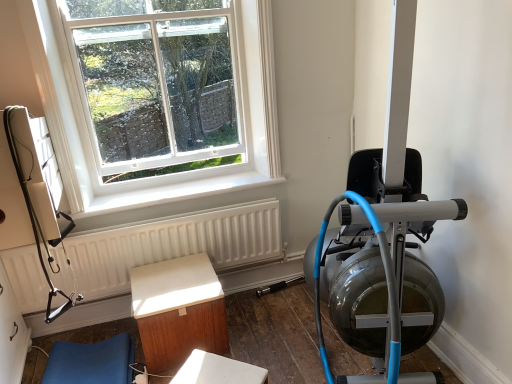
Question: Does light brown wood table at center, acting as the 2th furniture starting from the left, have a lesser width compared to blue rubber rowing machine at right?

Choices:
 (A) no
 (B) yes

Answer: (A)

Question: From a real-world perspective, is light brown wood table at center, the first furniture when ordered from right to left, positioned over blue rubber rowing machine at right based on gravity?

Choices:
 (A) no
 (B) yes

Answer: (A)

Question: From a real-world perspective, is light brown wood table at center, the first furniture when ordered from right to left, below blue rubber rowing machine at right?

Choices:
 (A) yes
 (B) no

Answer: (A)

Question: Could you tell me if light brown wood table at center, the first furniture when ordered from right to left, is turned towards blue rubber rowing machine at right?

Choices:
 (A) no
 (B) yes

Answer: (A)

Question: Can you confirm if light brown wood table at center, acting as the 2th furniture starting from the left, is shorter than blue rubber rowing machine at right?

Choices:
 (A) no
 (B) yes

Answer: (B)

Question: Is blue rubber rowing machine at right situated inside blue fabric cushion at lower left, placed as the first furniture when sorted from left to right, or outside?

Choices:
 (A) outside
 (B) inside

Answer: (A)

Question: Looking at their shapes, would you say blue rubber rowing machine at right is wider or thinner than blue fabric cushion at lower left, placed as the first furniture when sorted from left to right?

Choices:
 (A) wide
 (B) thin

Answer: (B)

Question: Considering the positions of blue rubber rowing machine at right and blue fabric cushion at lower left, placed as the first furniture when sorted from left to right, in the image, is blue rubber rowing machine at right taller or shorter than blue fabric cushion at lower left, placed as the first furniture when sorted from left to right,?

Choices:
 (A) tall
 (B) short

Answer: (A)

Question: Is blue rubber rowing machine at right to the left or to the right of blue fabric cushion at lower left, placed as the first furniture when sorted from left to right, in the image?

Choices:
 (A) right
 (B) left

Answer: (A)

Question: Is white matte radiator at lower center inside the boundaries of blue fabric cushion at lower left, the 2th furniture from the right, or outside?

Choices:
 (A) outside
 (B) inside

Answer: (A)

Question: From the image's perspective, is white matte radiator at lower center positioned above or below blue fabric cushion at lower left, the 2th furniture from the right?

Choices:
 (A) below
 (B) above

Answer: (B)

Question: From their relative heights in the image, would you say white matte radiator at lower center is taller or shorter than blue fabric cushion at lower left, the 2th furniture from the right?

Choices:
 (A) tall
 (B) short

Answer: (A)

Question: Considering the positions of white matte radiator at lower center and blue fabric cushion at lower left, the 2th furniture from the right, in the image, is white matte radiator at lower center wider or thinner than blue fabric cushion at lower left, the 2th furniture from the right,?

Choices:
 (A) wide
 (B) thin

Answer: (B)

Question: From the image's perspective, is white glass window at upper left located above or below blue rubber rowing machine at right?

Choices:
 (A) above
 (B) below

Answer: (A)

Question: Considering their positions, is white glass window at upper left located in front of or behind blue rubber rowing machine at right?

Choices:
 (A) behind
 (B) front

Answer: (A)